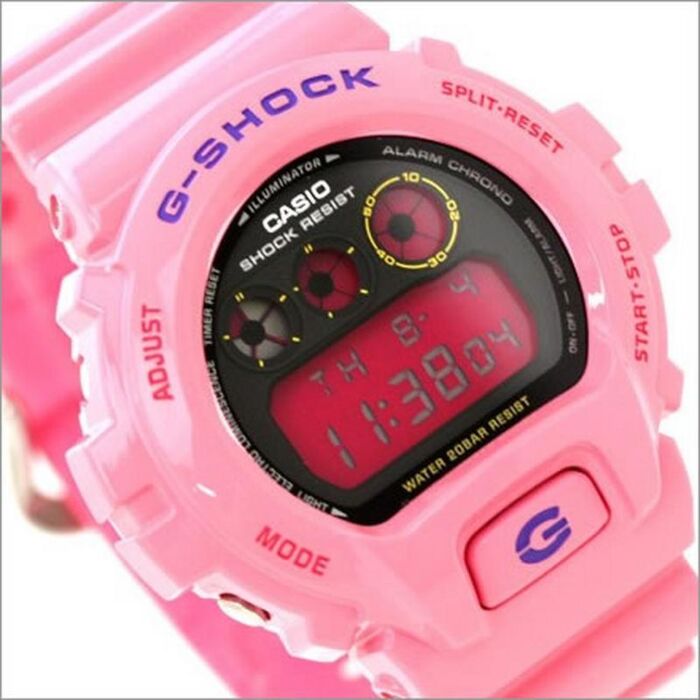
Find the location of a particular element. screen is located at coordinates (328, 404).